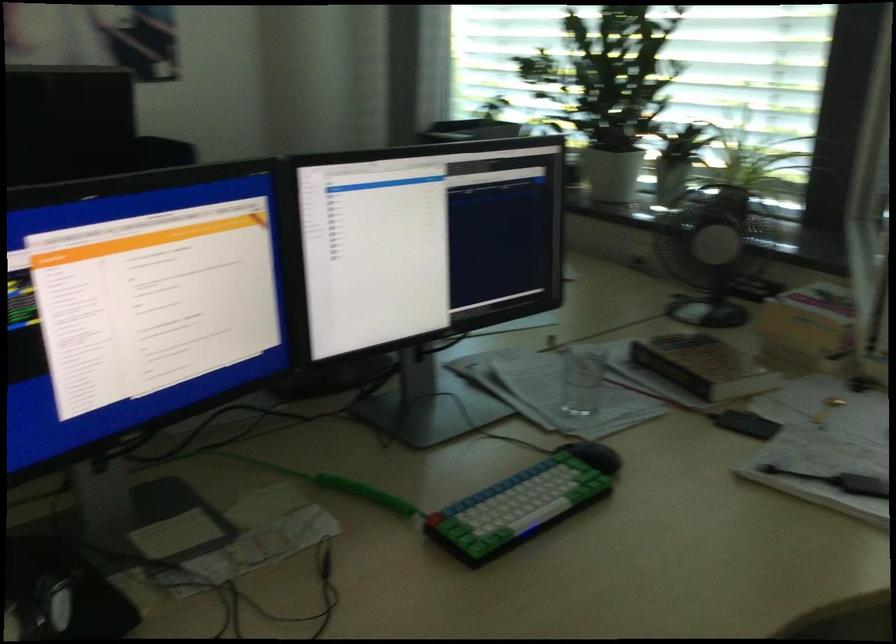
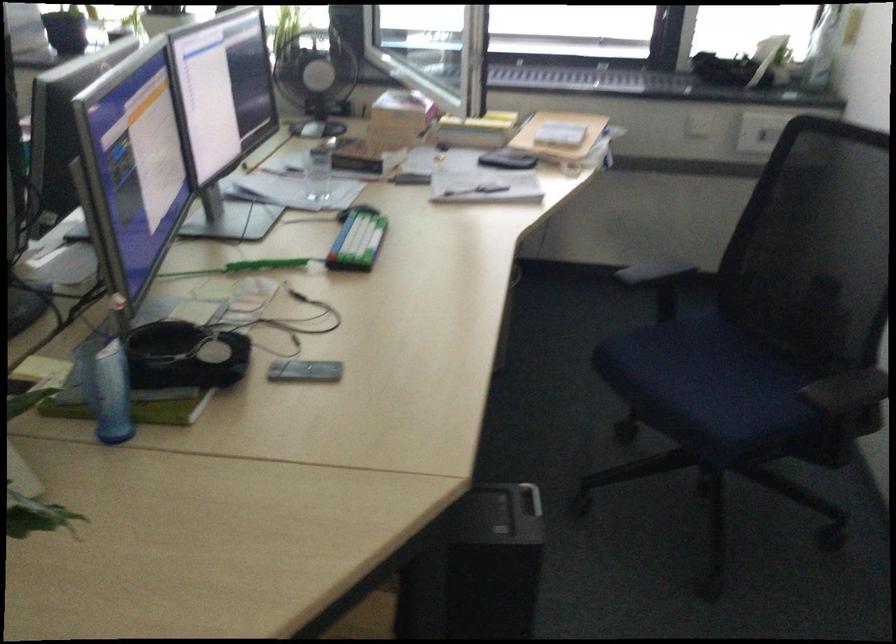
Find the pixel in the second image that matches point (504, 502) in the first image.

(357, 240)